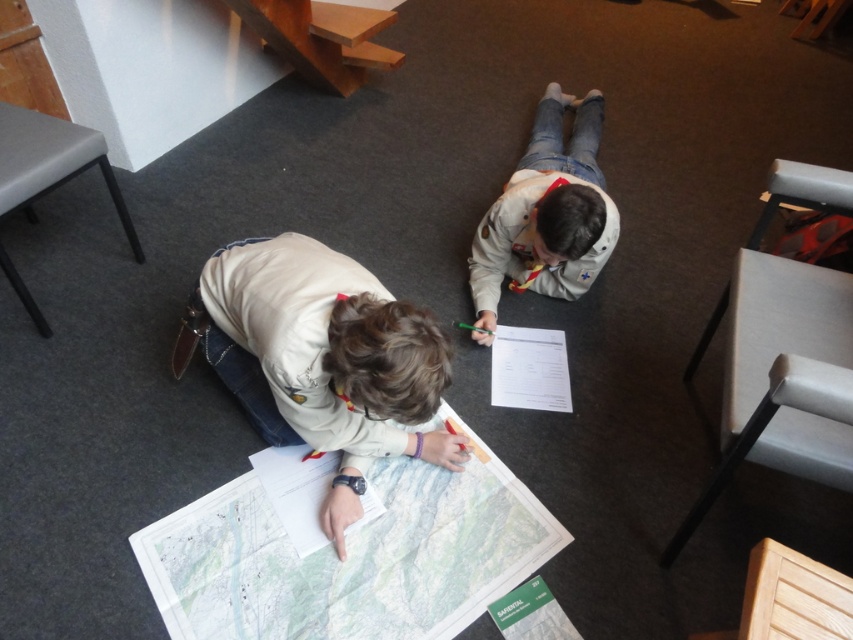
Question: Which object is the farthest from the white matte jacket at lower left?

Choices:
 (A) white paper map at center
 (B) white uniform at center

Answer: (B)

Question: Does white paper map at center come in front of white matte jacket at lower left?

Choices:
 (A) yes
 (B) no

Answer: (B)

Question: Can you confirm if white paper map at center is positioned above white matte jacket at lower left?

Choices:
 (A) yes
 (B) no

Answer: (B)

Question: Estimate the real-world distances between objects in this image. Which object is farther from the white uniform at center?

Choices:
 (A) white paper map at center
 (B) white matte jacket at lower left

Answer: (A)

Question: Does white paper map at center lie in front of white matte jacket at lower left?

Choices:
 (A) yes
 (B) no

Answer: (B)

Question: Which point is closer to the camera taking this photo?

Choices:
 (A) (343, 545)
 (B) (165, 564)

Answer: (B)